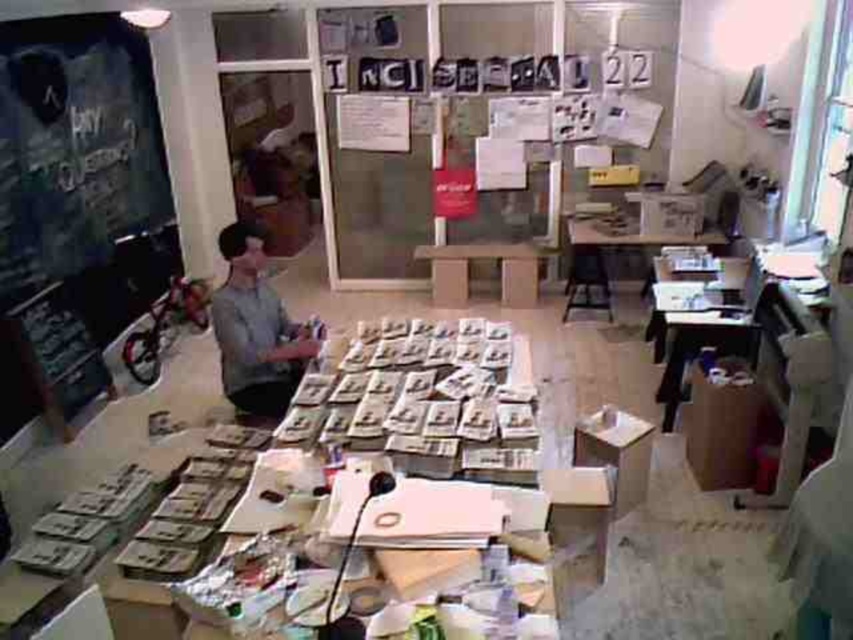
Who is more forward, (42, 380) or (248, 406)?

Positioned in front is point (248, 406).

Is point (32, 26) farther from viewer compared to point (238, 280)?

That is True.

Find the location of a particular element. denim fabric bulletin board at left is located at coordinates (74, 209).

Can you confirm if gray matte shirt at center is shorter than wooden table at center?

No.

Which is above, gray matte shirt at center or wooden table at center?

wooden table at center

Describe the element at coordinates (254, 330) in the screenshot. The width and height of the screenshot is (853, 640). I see `gray matte shirt at center` at that location.

The width and height of the screenshot is (853, 640). I want to click on gray matte shirt at center, so click(254, 330).

Is the position of denim fabric bulletin board at left more distant than that of wooden table at center?

No, it is in front of wooden table at center.

Which of these two, denim fabric bulletin board at left or wooden table at center, stands taller?

denim fabric bulletin board at left is taller.

Is point (84, 29) closer to camera compared to point (653, 243)?

Yes, point (84, 29) is closer to viewer.

Where is `denim fabric bulletin board at left`? The height and width of the screenshot is (640, 853). denim fabric bulletin board at left is located at coordinates (74, 209).